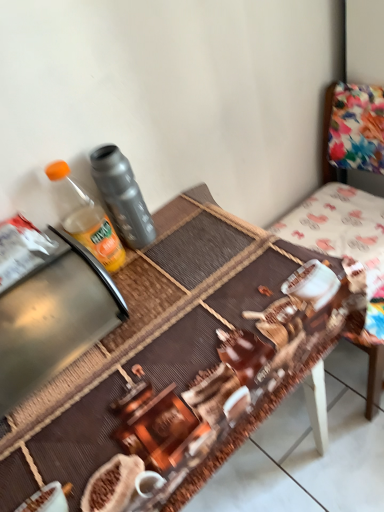
Question: From a real-world perspective, is translucent plastic bottle at upper left, acting as the 1th bottle starting from the left, positioned above or below floral fabric chair at upper right?

Choices:
 (A) above
 (B) below

Answer: (A)

Question: From the image's perspective, is translucent plastic bottle at upper left, arranged as the second bottle when viewed from the right, above or below floral fabric chair at upper right?

Choices:
 (A) below
 (B) above

Answer: (B)

Question: Estimate the real-world distances between objects in this image. Which object is farther from the metallic stainless steel appliance at left?

Choices:
 (A) floral fabric chair at upper right
 (B) translucent plastic bottle at upper left, acting as the 1th bottle starting from the left
 (C) matte gray thermos at left, the 2th bottle when ordered from left to right
 (D) brown woven mat at center

Answer: (A)

Question: Which object is the closest to the translucent plastic bottle at upper left, arranged as the second bottle when viewed from the right?

Choices:
 (A) matte gray thermos at left, the 2th bottle when ordered from left to right
 (B) metallic stainless steel appliance at left
 (C) floral fabric chair at upper right
 (D) brown woven mat at center

Answer: (A)